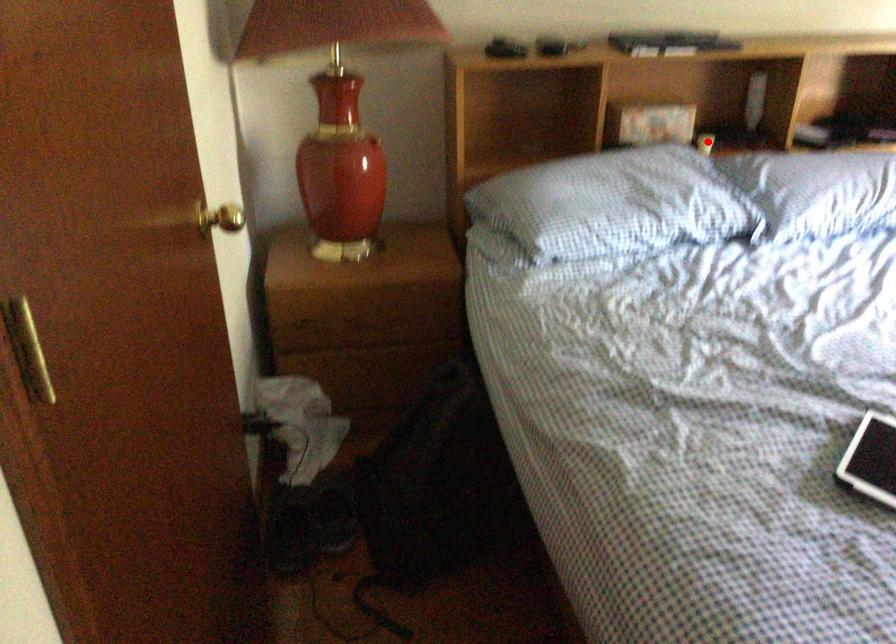
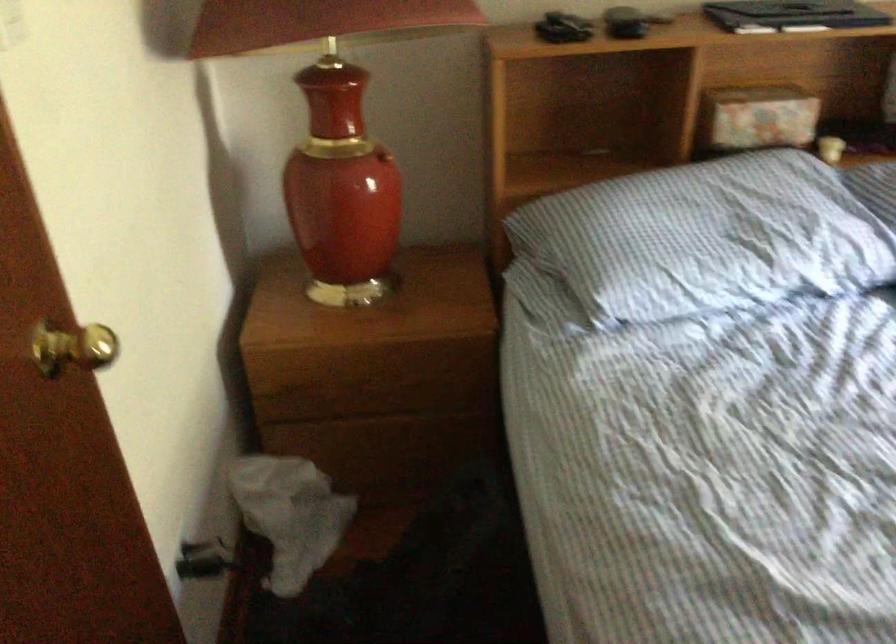
Where in the second image is the point corresponding to the highlighted location from the first image?

(830, 149)